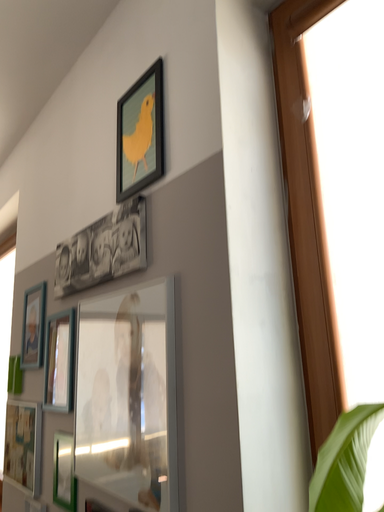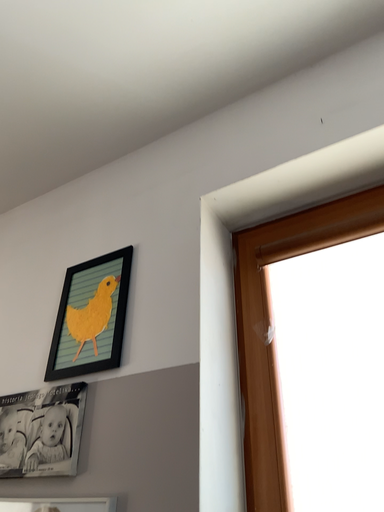
Question: How did the camera likely rotate when shooting the video?

Choices:
 (A) rotated left
 (B) rotated right

Answer: (B)